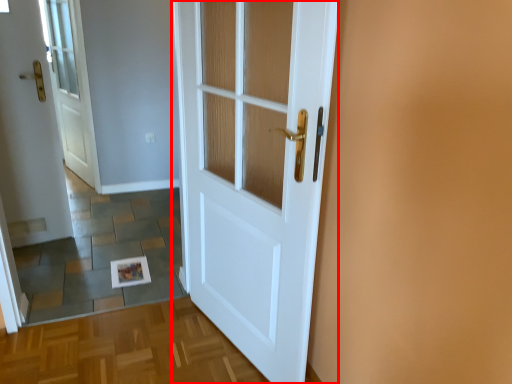
Question: Observing the image, what is the correct spatial positioning of door (annotated by the red box) in reference to door?

Choices:
 (A) right
 (B) left

Answer: (A)